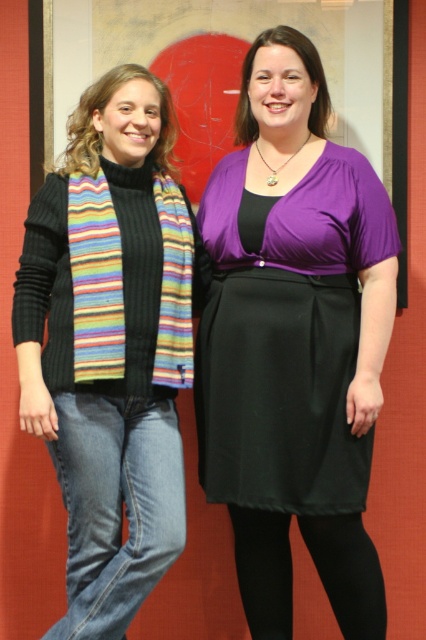
You are a photographer setting up for a portrait. You notice the striped knit scarf at left and the black tights at lower center in the frame. Which object should you focus on first to ensure both are in sharp focus?

The striped knit scarf at left is closer to the viewer than the black tights at lower center. To ensure both are in sharp focus, you should focus on the striped knit scarf at left first since it is closer, allowing the depth of field to extend to the farther object.

You are trying to decide which item to take with you for a chilly evening. Based on the image, which item appears to be wider, the striped knit scarf at left or the black tights at lower center?

The striped knit scarf at left might be wider than the black tights at lower center according to the description.

You are standing in front of the image and need to locate the denim jeans at lower left. According to the coordinates provided, where exactly would you look to find them?

The denim jeans at lower left can be found at the coordinates point (115, 506).